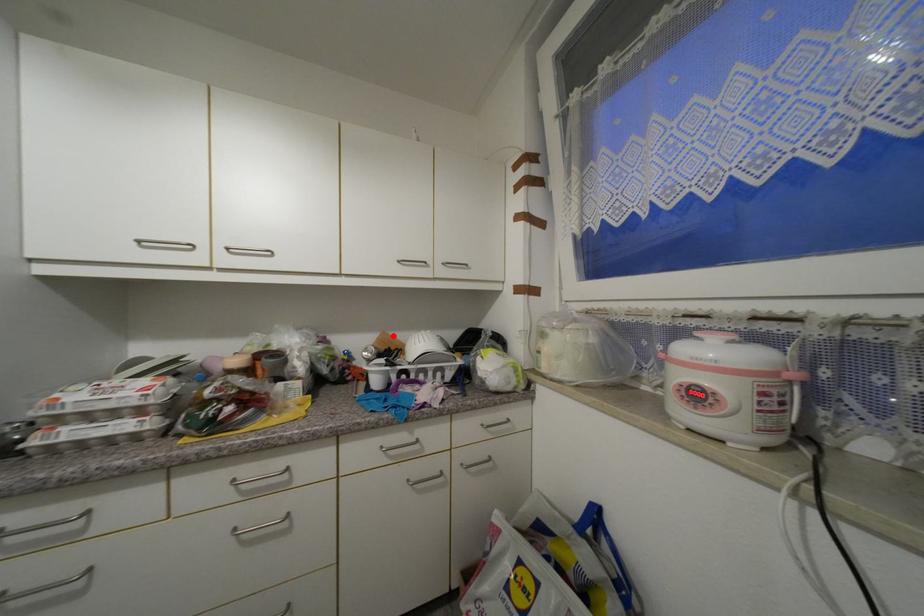
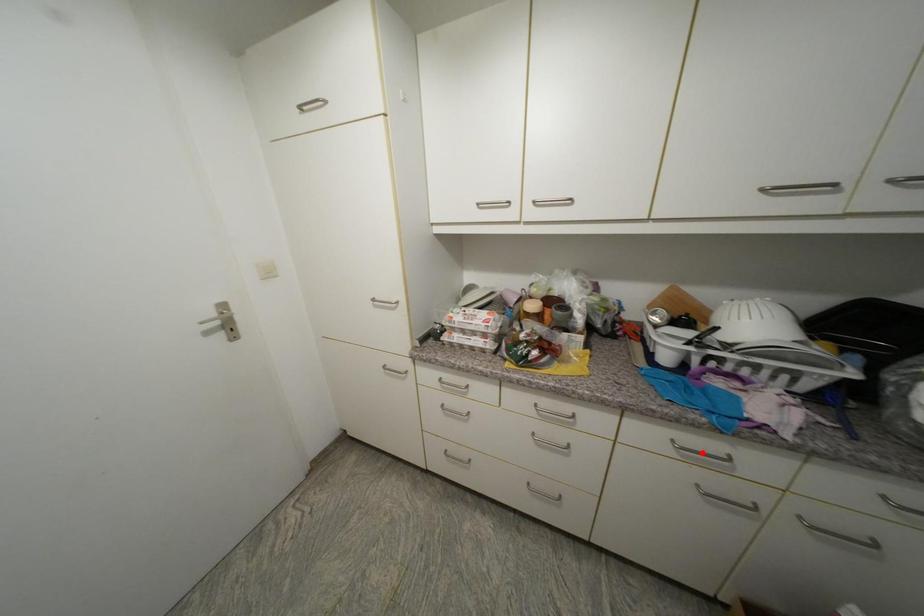
I am providing you with two images of the same scene from different viewpoints. A red point is marked on the first image and another point is marked on the second image. Do the highlighted points in image1 and image2 indicate the same real-world spot?

No